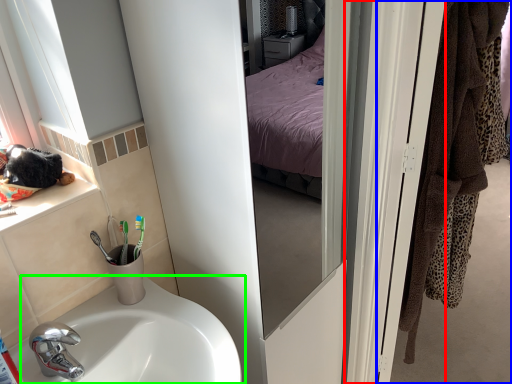
Question: Which is nearer to the screen door (highlighted by a red box)? door (highlighted by a blue box) or sink (highlighted by a green box).

Choices:
 (A) door
 (B) sink

Answer: (B)